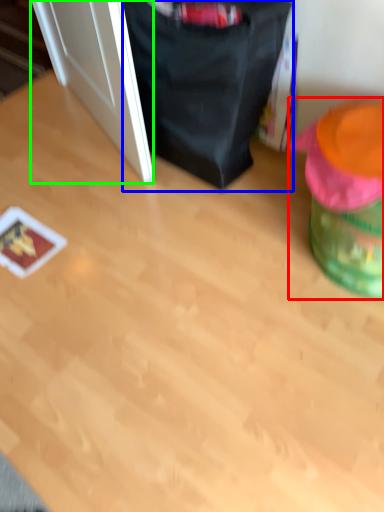
Question: Considering the real-world distances, which object is closest to bean bag chair (highlighted by a red box)? bean bag chair (highlighted by a blue box) or door (highlighted by a green box).

Choices:
 (A) bean bag chair
 (B) door

Answer: (A)